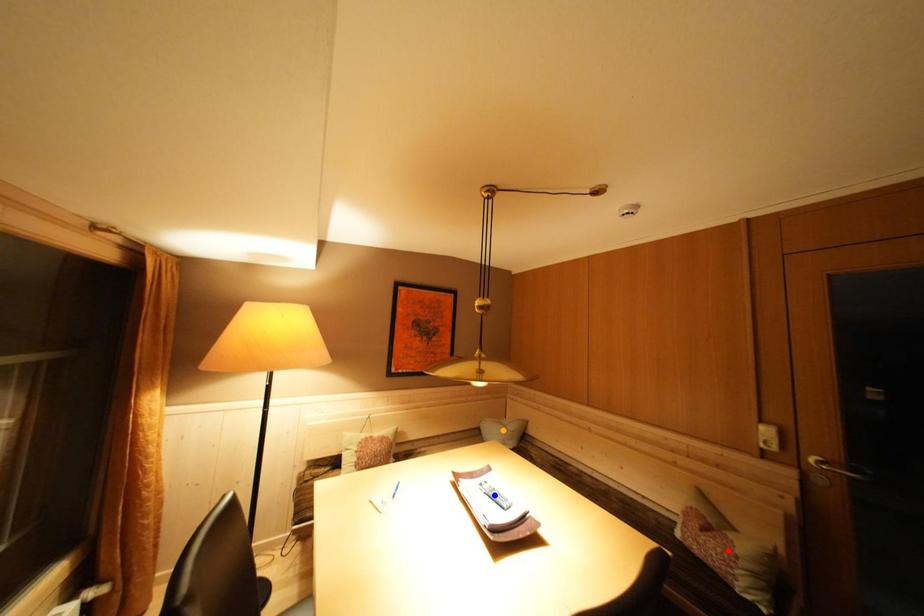
Order these from nearest to farthest:
red point, blue point, orange point

red point < blue point < orange point